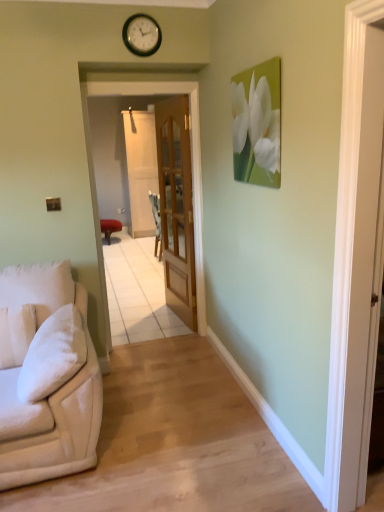
Question: Would you say wooden glass door at center is part of clear glass screen door at center, marked as the second screen door in a front-to-back arrangement,'s contents?

Choices:
 (A) yes
 (B) no

Answer: (B)

Question: Are clear glass screen door at center, marked as the second screen door in a front-to-back arrangement, and wooden glass door at center far apart?

Choices:
 (A) yes
 (B) no

Answer: (A)

Question: Can you confirm if clear glass screen door at center, marked as the second screen door in a front-to-back arrangement, is taller than wooden glass door at center?

Choices:
 (A) no
 (B) yes

Answer: (B)

Question: Considering the relative sizes of clear glass screen door at center, marked as the second screen door in a front-to-back arrangement, and wooden glass door at center in the image provided, is clear glass screen door at center, marked as the second screen door in a front-to-back arrangement, wider than wooden glass door at center?

Choices:
 (A) no
 (B) yes

Answer: (B)

Question: From the image's perspective, would you say clear glass screen door at center, marked as the second screen door in a front-to-back arrangement, is positioned over wooden glass door at center?

Choices:
 (A) yes
 (B) no

Answer: (A)

Question: Can you confirm if clear glass screen door at center, which appears as the first screen door when viewed from the back, is positioned to the left of wooden glass door at center?

Choices:
 (A) yes
 (B) no

Answer: (A)

Question: From a real-world perspective, is beige fabric couch at left under white matte flower at upper right?

Choices:
 (A) yes
 (B) no

Answer: (A)

Question: Considering the relative sizes of beige fabric couch at left and white matte flower at upper right in the image provided, is beige fabric couch at left taller than white matte flower at upper right?

Choices:
 (A) yes
 (B) no

Answer: (B)

Question: From a real-world perspective, is beige fabric couch at left on white matte flower at upper right?

Choices:
 (A) yes
 (B) no

Answer: (B)

Question: Can you confirm if beige fabric couch at left is wider than white matte flower at upper right?

Choices:
 (A) yes
 (B) no

Answer: (A)

Question: Are beige fabric couch at left and white matte flower at upper right making contact?

Choices:
 (A) yes
 (B) no

Answer: (B)

Question: Is beige fabric couch at left thinner than white matte flower at upper right?

Choices:
 (A) no
 (B) yes

Answer: (A)

Question: Is matte red stool at center to the right of beige fabric couch at left from the viewer's perspective?

Choices:
 (A) no
 (B) yes

Answer: (A)